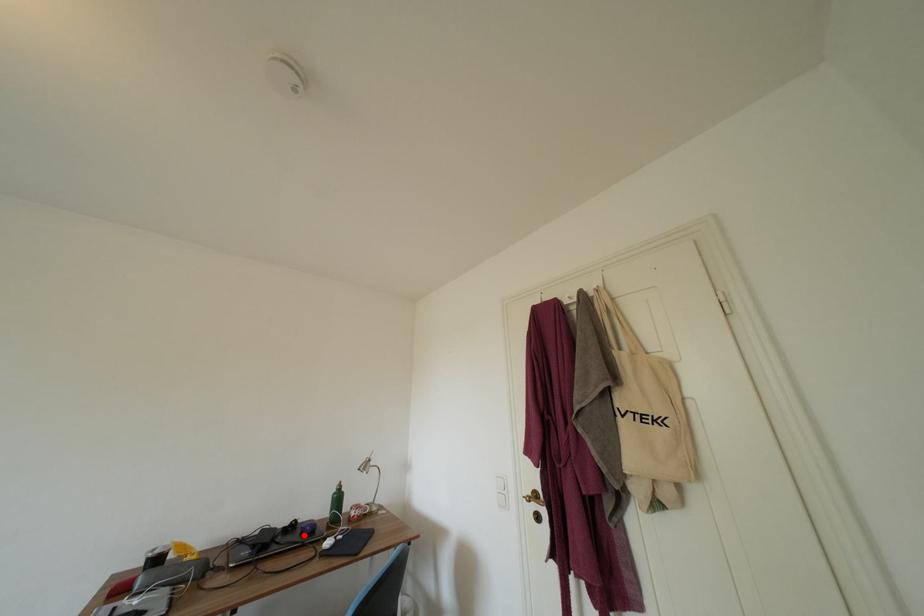
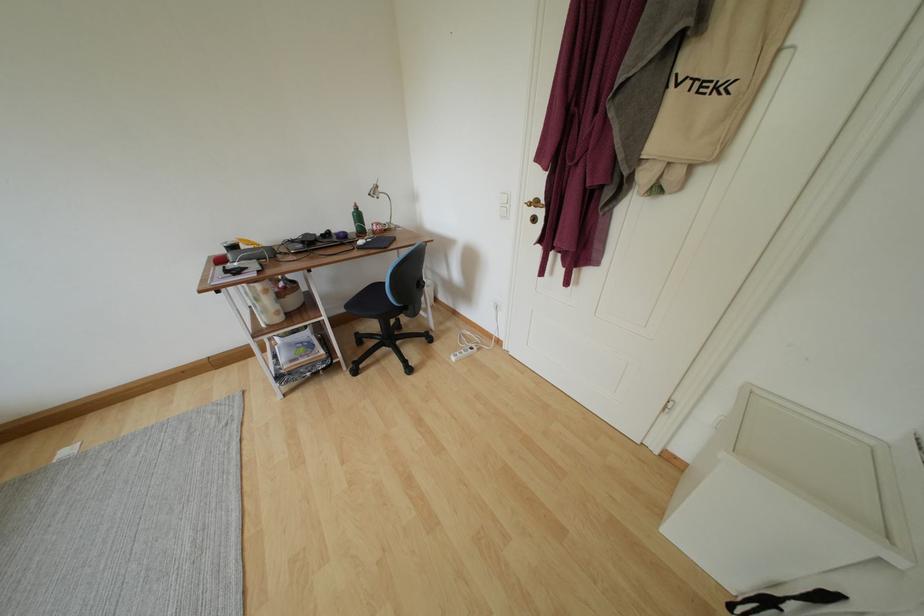
Question: I am providing you with two images of the same scene from different viewpoints. A red point is marked on the first image. Is the red point's position out of view in image 2?

Choices:
 (A) Yes
 (B) No

Answer: (B)